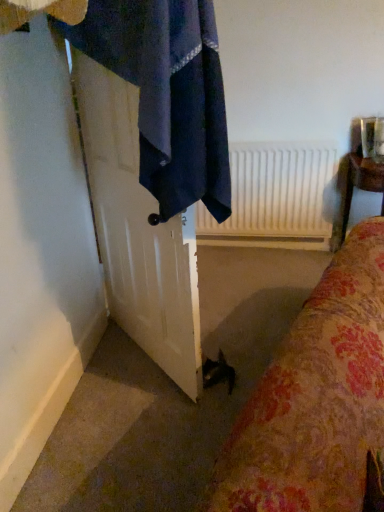
I want to click on white glossy door at left, so click(138, 231).

Looking at this image, is dark blue fabric towel at upper left at the left side of white matte radiator at upper center?

Correct, you'll find dark blue fabric towel at upper left to the left of white matte radiator at upper center.

Is dark blue fabric towel at upper left not inside white matte radiator at upper center?

That's correct, dark blue fabric towel at upper left is outside of white matte radiator at upper center.

At what (x,y) coordinates should I click in order to perform the action: click on bath towel in front of the white matte radiator at upper center. Please return your answer as a coordinate pair (x, y). This screenshot has height=512, width=384. Looking at the image, I should click on click(167, 94).

Considering the sizes of objects dark blue fabric towel at upper left and white matte radiator at upper center in the image provided, who is wider, dark blue fabric towel at upper left or white matte radiator at upper center?

With larger width is dark blue fabric towel at upper left.

From a real-world perspective, which is physically above, white glossy door at left or white matte radiator at upper center?

In real-world perspective, white glossy door at left is above.

Can you confirm if white glossy door at left is thinner than white matte radiator at upper center?

In fact, white glossy door at left might be wider than white matte radiator at upper center.

How different are the orientations of white glossy door at left and white matte radiator at upper center in degrees?

The angular difference between white glossy door at left and white matte radiator at upper center is 134 degrees.

Based on the photo, could white matte radiator at upper center be considered to be inside white glossy door at left?

Actually, white matte radiator at upper center is outside white glossy door at left.

Is white matte radiator at upper center wider or thinner than dark blue fabric towel at upper left?

white matte radiator at upper center is thinner than dark blue fabric towel at upper left.

Looking at this image, is white matte radiator at upper center aimed at dark blue fabric towel at upper left?

No, white matte radiator at upper center does not turn towards dark blue fabric towel at upper left.

Considering the relative positions of white matte radiator at upper center and dark blue fabric towel at upper left in the image provided, is white matte radiator at upper center to the left or to the right of dark blue fabric towel at upper left?

white matte radiator at upper center is positioned on dark blue fabric towel at upper left's right side.

Which is closer to the camera, (268, 151) or (216, 69)?

Point (268, 151) appears to be farther away from the viewer than point (216, 69).

Between white glossy door at left and dark blue fabric towel at upper left, which one is positioned behind?

white glossy door at left is further from the camera.

From a real-world perspective, is white glossy door at left under dark blue fabric towel at upper left?

Yes, from a real-world perspective, white glossy door at left is beneath dark blue fabric towel at upper left.

Would you say white glossy door at left is to the left or to the right of dark blue fabric towel at upper left in the picture?

white glossy door at left is to the left of dark blue fabric towel at upper left.

Is white glossy door at left not within dark blue fabric towel at upper left?

Actually, white glossy door at left is at least partially inside dark blue fabric towel at upper left.

Which object is positioned more to the left, white matte radiator at upper center or white glossy door at left?

white glossy door at left is more to the left.

Which of these two, white matte radiator at upper center or white glossy door at left, is wider?

With larger width is white glossy door at left.

Considering the sizes of objects white matte radiator at upper center and white glossy door at left in the image provided, who is bigger, white matte radiator at upper center or white glossy door at left?

Bigger between the two is white glossy door at left.

Considering the relative sizes of wooden chair at right and white matte radiator at upper center in the image provided, is wooden chair at right smaller than white matte radiator at upper center?

No, wooden chair at right is not smaller than white matte radiator at upper center.

In the image, there is a white matte radiator at upper center. Find the location of `furniture below it (from a real-world perspective)`. furniture below it (from a real-world perspective) is located at coordinates (361, 184).

Considering the relative sizes of wooden chair at right and white matte radiator at upper center in the image provided, is wooden chair at right thinner than white matte radiator at upper center?

Incorrect, the width of wooden chair at right is not less than that of white matte radiator at upper center.

Is point (373, 176) farther from viewer compared to point (237, 242)?

No, it is not.

Is wooden chair at right located outside dark blue fabric towel at upper left?

wooden chair at right is positioned outside dark blue fabric towel at upper left.

From a real-world perspective, who is located lower, wooden chair at right or dark blue fabric towel at upper left?

In real-world perspective, wooden chair at right is lower.

Based on their positions, is wooden chair at right located to the left or right of dark blue fabric towel at upper left?

From the image, it's evident that wooden chair at right is to the right of dark blue fabric towel at upper left.

Find the location of a particular element. The width and height of the screenshot is (384, 512). bath towel that is above the white matte radiator at upper center (from the image's perspective) is located at coordinates (167, 94).

Identify the location of screen door on the left of the white matte radiator at upper center. This screenshot has height=512, width=384. (138, 231).

Based on their spatial positions, is white matte radiator at upper center or white glossy door at left closer to dark blue fabric towel at upper left?

white glossy door at left.

Which object lies nearer to the anchor point white glossy door at left, white matte radiator at upper center or wooden chair at right?

white matte radiator at upper center lies closer to white glossy door at left than the other object.

Based on the photo, looking at the image, which one is located further to white glossy door at left, wooden chair at right or white matte radiator at upper center?

wooden chair at right is further to white glossy door at left.

Considering their positions, is wooden chair at right positioned further to white matte radiator at upper center than white glossy door at left?

Based on the image, white glossy door at left appears to be further to white matte radiator at upper center.

Which object lies further to the anchor point wooden chair at right, white matte radiator at upper center or dark blue fabric towel at upper left?

dark blue fabric towel at upper left.

Considering their positions, is white glossy door at left positioned further to wooden chair at right than dark blue fabric towel at upper left?

The object further to wooden chair at right is dark blue fabric towel at upper left.

From the image, which object appears to be farther from white glossy door at left, white matte radiator at upper center or dark blue fabric towel at upper left?

white matte radiator at upper center is further to white glossy door at left.

Looking at the image, which one is located closer to wooden chair at right, dark blue fabric towel at upper left or white matte radiator at upper center?

white matte radiator at upper center lies closer to wooden chair at right than the other object.

Where is `screen door located between dark blue fabric towel at upper left and wooden chair at right in the depth direction`? screen door located between dark blue fabric towel at upper left and wooden chair at right in the depth direction is located at coordinates (138, 231).

Where is `screen door positioned between dark blue fabric towel at upper left and white matte radiator at upper center from near to far`? screen door positioned between dark blue fabric towel at upper left and white matte radiator at upper center from near to far is located at coordinates (138, 231).

At what (x,y) coordinates should I click in order to perform the action: click on furniture between white glossy door at left and white matte radiator at upper center along the z-axis. Please return your answer as a coordinate pair (x, y). Looking at the image, I should click on tap(361, 184).

This screenshot has height=512, width=384. I want to click on furniture between dark blue fabric towel at upper left and white matte radiator at upper center along the z-axis, so click(x=361, y=184).